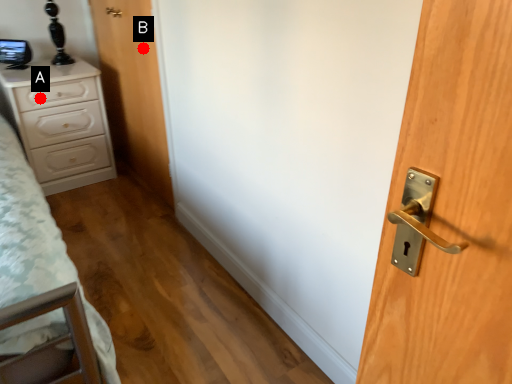
Question: Two points are circled on the image, labeled by A and B beside each circle. Which point is further to the camera?

Choices:
 (A) A is further
 (B) B is further

Answer: (A)